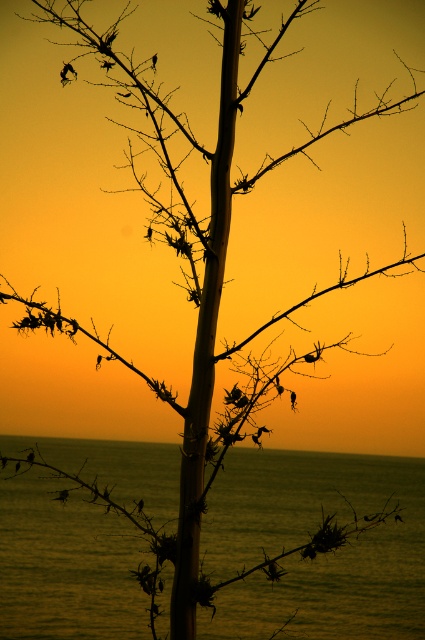
Question: Which point is closer to the camera taking this photo?

Choices:
 (A) (136, 518)
 (B) (295, 305)

Answer: (B)

Question: Can you confirm if brown thorny branch at center is thinner than silhouette thorny branch at center?

Choices:
 (A) yes
 (B) no

Answer: (B)

Question: Can you confirm if brown thorny branch at lower left is smaller than silvery metallic branch at center?

Choices:
 (A) yes
 (B) no

Answer: (B)

Question: Which of the following is the closest to the observer?

Choices:
 (A) (340, 262)
 (B) (127, 451)
 (C) (22, 460)
 (D) (325, 534)

Answer: (D)

Question: Which of the following is the farthest from the observer?

Choices:
 (A) brown thorny branch at center
 (B) smooth water at center
 (C) silvery metallic branch at center

Answer: (B)

Question: Can you confirm if brown thorny branch at center is bigger than brown thorny branch at lower left?

Choices:
 (A) yes
 (B) no

Answer: (B)